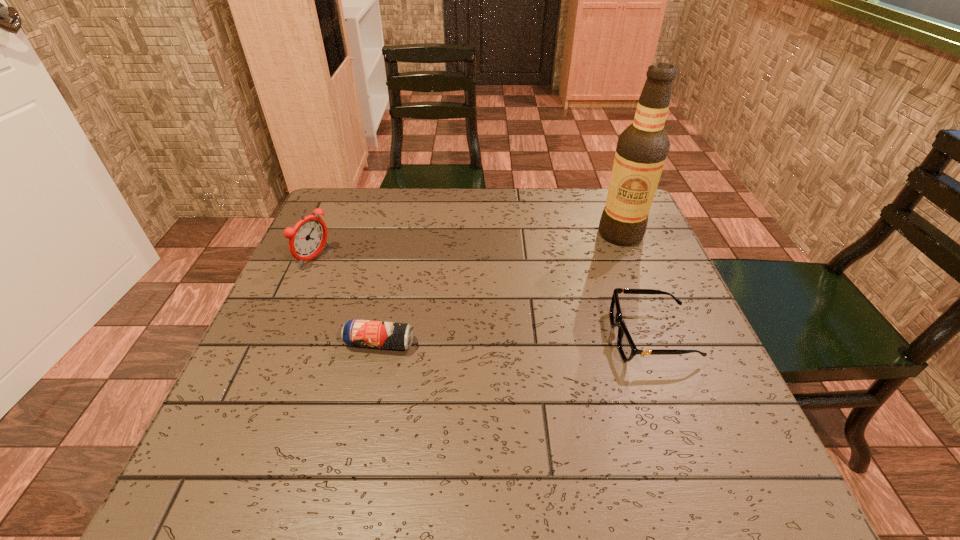
You are a GUI agent. You are given a task and a screenshot of the screen. Output one action in this format:
    pyautogui.click(x=<x>, y=<y>)
    Task: Click on the third object from right to left
    The height and width of the screenshot is (540, 960).
    Given the screenshot: What is the action you would take?
    pyautogui.click(x=390, y=335)

Find the location of a particular element. The width and height of the screenshot is (960, 540). sunglasses is located at coordinates (x=627, y=349).

Locate an element on the screen. This screenshot has width=960, height=540. alcohol is located at coordinates (642, 148).

Locate an element on the screen. alarm clock is located at coordinates (308, 237).

This screenshot has height=540, width=960. In order to click on the leftmost object in this screenshot , I will do `click(308, 237)`.

The width and height of the screenshot is (960, 540). In order to click on vacant region located on the back of the third object from right to left in this screenshot , I will do `click(390, 298)`.

Locate an element on the screen. Image resolution: width=960 pixels, height=540 pixels. vacant space located 0.080m on the front-facing side of the sunglasses is located at coordinates (572, 337).

Where is `free location located on the front-facing side of the sunglasses`? free location located on the front-facing side of the sunglasses is located at coordinates (553, 337).

Image resolution: width=960 pixels, height=540 pixels. What are the coordinates of `vacant space located on the front-facing side of the sunglasses` in the screenshot? It's located at (474, 337).

You are a GUI agent. You are given a task and a screenshot of the screen. Output one action in this format:
    pyautogui.click(x=<x>, y=<y>)
    Task: Click on the vacant space situated on the label of the tallest object
    
    Given the screenshot: What is the action you would take?
    pyautogui.click(x=595, y=257)